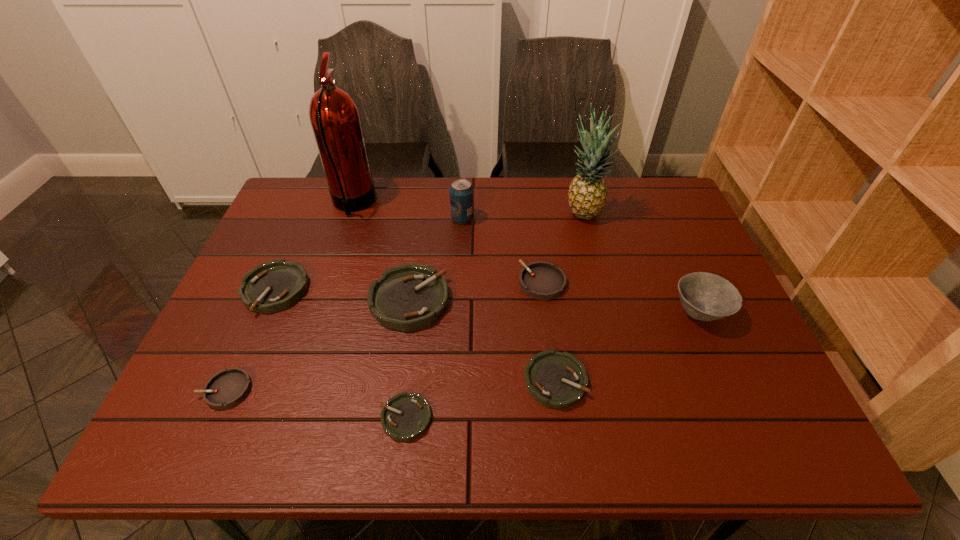
I want to click on ashtray object that ranks as the closest to the pop soda, so click(x=408, y=297).

The image size is (960, 540). In order to click on green ashtray identified as the second closest to the smallest green ashtray in this screenshot , I will do `click(554, 379)`.

Locate an element on the screen. This screenshot has width=960, height=540. green ashtray that is the closest to the eighth shortest object is located at coordinates click(408, 297).

Find the location of a particular element. The image size is (960, 540). free space that satisfies the following two spatial constraints: 1. on the front-facing side of the farther gray ashtray; 2. on the right side of the tallest object is located at coordinates (327, 283).

Find the location of a particular element. This screenshot has height=540, width=960. vacant space that satisfies the following two spatial constraints: 1. on the front-facing side of the red fire extinguisher; 2. on the left side of the farther gray ashtray is located at coordinates 327,283.

The height and width of the screenshot is (540, 960). I want to click on vacant space that satisfies the following two spatial constraints: 1. on the front-facing side of the fire extinguisher; 2. on the left side of the yellow pineapple, so click(350, 213).

Identify the location of vacant point that satisfies the following two spatial constraints: 1. on the back side of the rightmost green ashtray; 2. on the left side of the rightmost object. (546, 312).